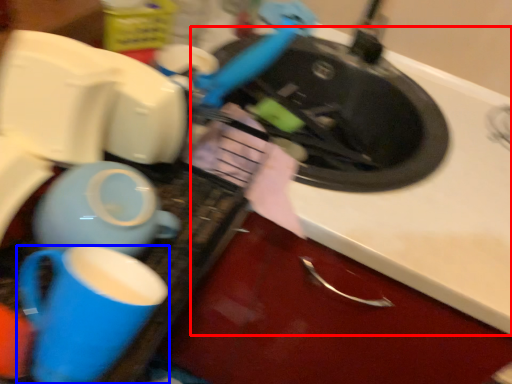
Question: Which point is closer to the camera, counter top (highlighted by a red box) or coffee cup (highlighted by a blue box)?

Choices:
 (A) counter top
 (B) coffee cup

Answer: (B)